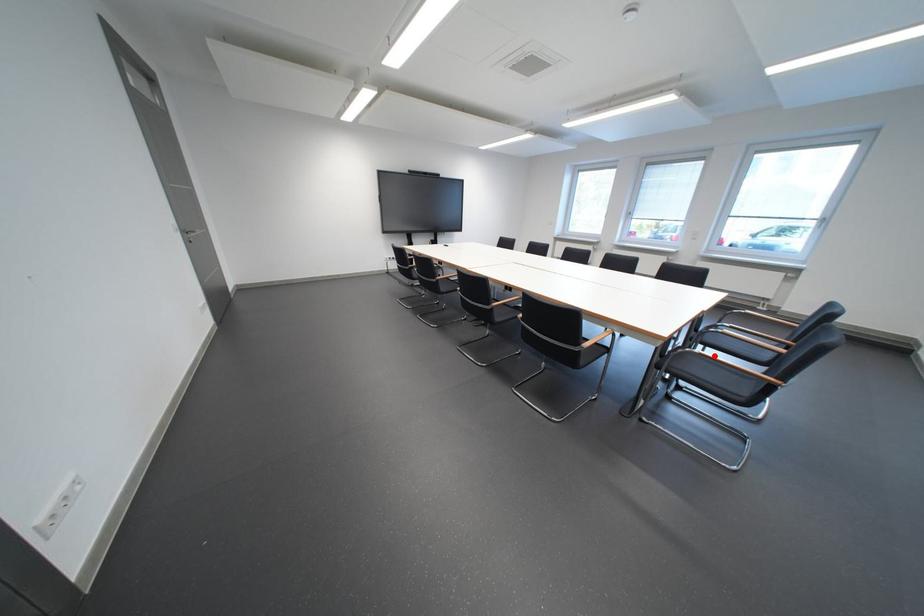
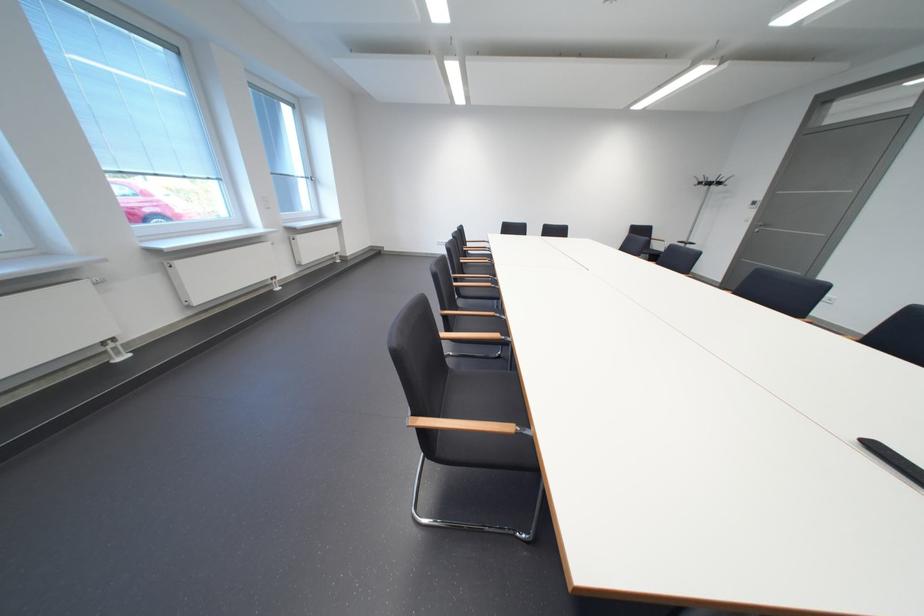
Question: I am providing you with two images of the same scene from different viewpoints. A red point is marked on the first image. At the location where the point appears in image 1, is it still visible in image 2?

Choices:
 (A) Yes
 (B) No

Answer: (B)